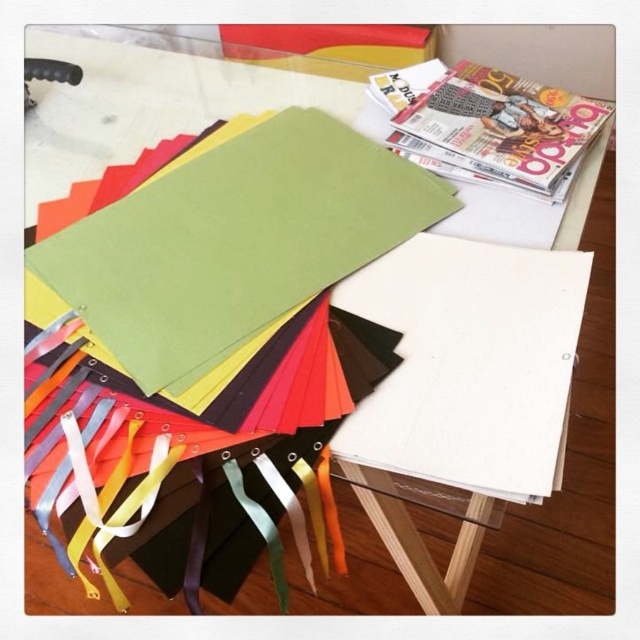
Question: Which object appears farthest from the camera in this image?

Choices:
 (A) matte paper magazine at upper right
 (B) green matte paper at upper center

Answer: (A)

Question: Is green matte paper at upper center positioned behind matte paper magazine at upper right?

Choices:
 (A) yes
 (B) no

Answer: (B)

Question: Is green matte paper at upper center positioned in front of matte paper magazine at upper right?

Choices:
 (A) no
 (B) yes

Answer: (B)

Question: Which of the following is the closest to the observer?

Choices:
 (A) green matte paper at upper center
 (B) matte paper magazine at upper right

Answer: (A)

Question: Observing the image, what is the correct spatial positioning of green matte paper at upper center in reference to matte paper magazine at upper right?

Choices:
 (A) right
 (B) left

Answer: (B)